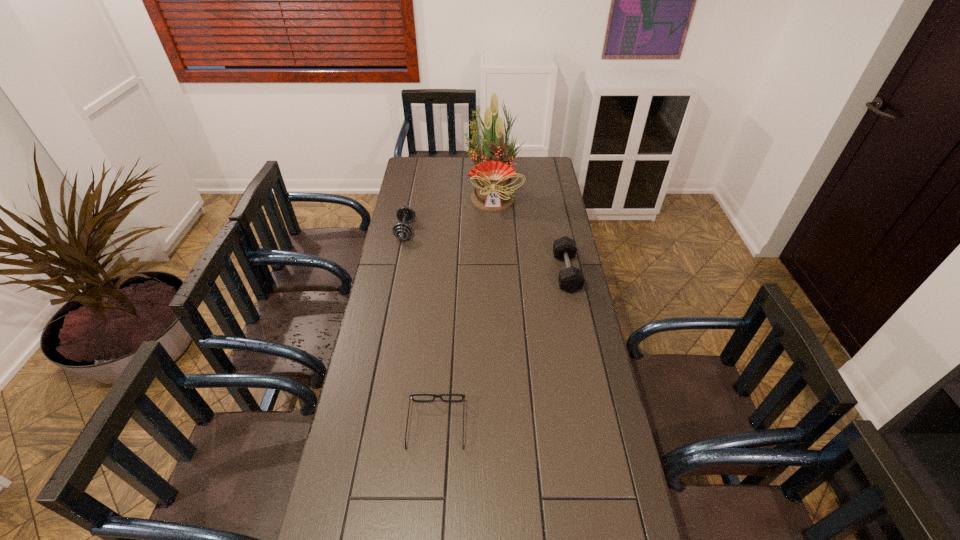
Where is `free space located on the back of the shorter dumbbell`? free space located on the back of the shorter dumbbell is located at coordinates [410, 209].

This screenshot has width=960, height=540. Find the location of `vacant space located on the front-facing side of the shortest object`. vacant space located on the front-facing side of the shortest object is located at coordinates (441, 368).

The image size is (960, 540). I want to click on vacant space situated on the front-facing side of the shortest object, so click(x=442, y=358).

In order to click on free space located on the front-facing side of the shortest object in this screenshot , I will do [x=444, y=325].

What are the coordinates of `object at the far edge` in the screenshot? It's located at 492,192.

The width and height of the screenshot is (960, 540). I want to click on object that is at the left edge, so click(x=402, y=230).

Find the location of a particular element. object that is at the right edge is located at coordinates [571, 279].

This screenshot has width=960, height=540. What are the coordinates of `vacant area at the left edge of the desktop` in the screenshot? It's located at (408, 193).

You are a GUI agent. You are given a task and a screenshot of the screen. Output one action in this format:
    pyautogui.click(x=<x>, y=<y>)
    Task: Click on the vacant space at the right edge of the desktop
    The width and height of the screenshot is (960, 540).
    Given the screenshot: What is the action you would take?
    pyautogui.click(x=540, y=198)

Find the location of `free space at the far left corner of the desktop`. free space at the far left corner of the desktop is located at coordinates (412, 157).